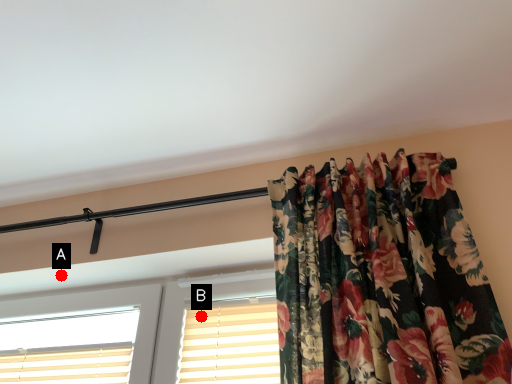
Question: Two points are circled on the image, labeled by A and B beside each circle. Which point is further to the camera?

Choices:
 (A) A is further
 (B) B is further

Answer: (A)